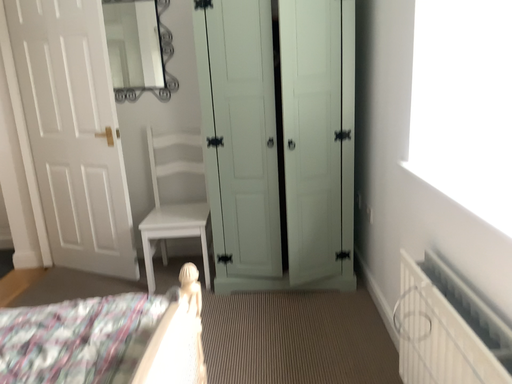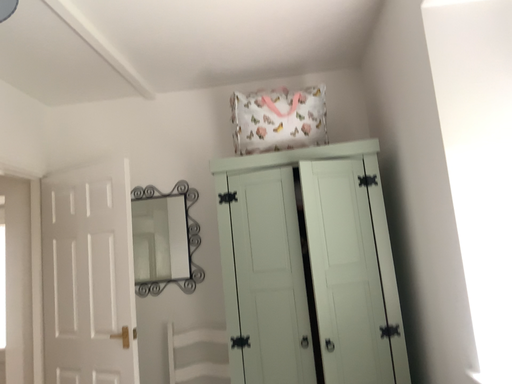
Question: Which way did the camera rotate in the video?

Choices:
 (A) rotated upward
 (B) rotated downward

Answer: (A)